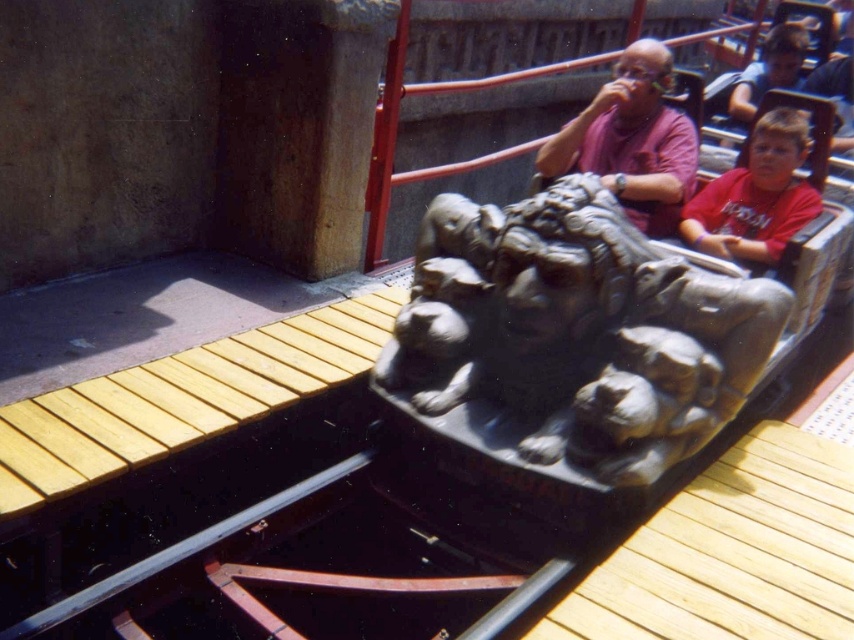
Is point (641, 49) closer to viewer compared to point (753, 250)?

No, it is not.

Consider the image. Who is more distant from viewer, (641,120) or (802,192)?

The point (641,120) is behind.

Does point (581, 170) come closer to viewer compared to point (687, 220)?

No, (581, 170) is behind (687, 220).

The height and width of the screenshot is (640, 854). In order to click on matte purple shirt at center in this screenshot , I will do `click(632, 140)`.

Does gray stone lion at center appear over matte purple shirt at center?

Incorrect, gray stone lion at center is not positioned above matte purple shirt at center.

Is the position of gray stone lion at center more distant than that of matte purple shirt at center?

No, it is in front of matte purple shirt at center.

Is point (676, 352) closer to camera compared to point (638, 120)?

That is True.

At what (x,y) coordinates should I click in order to perform the action: click on gray stone lion at center. Please return your answer as a coordinate pair (x, y). The width and height of the screenshot is (854, 640). Looking at the image, I should click on (577, 332).

Can you confirm if gray stone lion at center is positioned to the right of red cotton shirt at right?

Incorrect, gray stone lion at center is not on the right side of red cotton shirt at right.

You are a GUI agent. You are given a task and a screenshot of the screen. Output one action in this format:
    pyautogui.click(x=<x>, y=<y>)
    Task: Click on the gray stone lion at center
    The image size is (854, 640).
    Given the screenshot: What is the action you would take?
    coord(577,332)